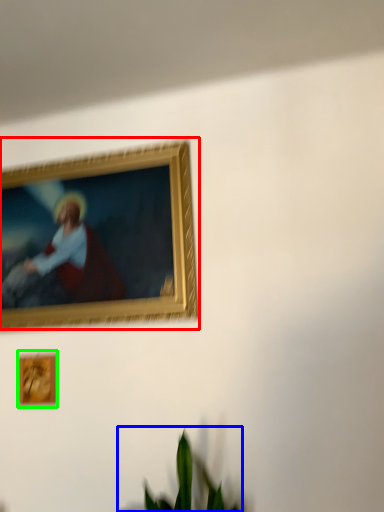
Question: Considering the real-world distances, which object is farthest from picture frame (highlighted by a red box)? houseplant (highlighted by a blue box) or picture frame (highlighted by a green box)?

Choices:
 (A) houseplant
 (B) picture frame

Answer: (A)